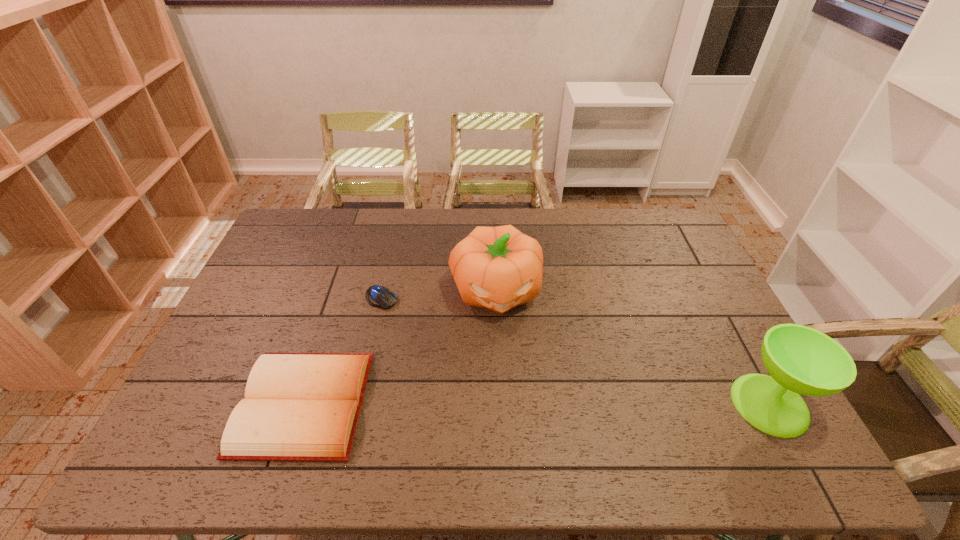
At what (x,y) coordinates should I click in order to perform the action: click on Bible. Please return your answer as a coordinate pair (x, y). Image resolution: width=960 pixels, height=540 pixels. Looking at the image, I should click on (298, 406).

At what (x,y) coordinates should I click in order to perform the action: click on wineglass. Please return your answer as a coordinate pair (x, y). Looking at the image, I should click on (801, 360).

This screenshot has height=540, width=960. In order to click on the shortest object in this screenshot , I will do pyautogui.click(x=377, y=296).

At what (x,y) coordinates should I click in order to perform the action: click on the third object from left to right. Please return your answer as a coordinate pair (x, y). This screenshot has height=540, width=960. Looking at the image, I should click on (498, 268).

The image size is (960, 540). I want to click on free spot located 0.330m on the right of the Bible, so click(492, 403).

Image resolution: width=960 pixels, height=540 pixels. Find the location of `vacant space located 0.240m on the left of the rightmost object`. vacant space located 0.240m on the left of the rightmost object is located at coordinates [x=639, y=404].

Where is `vacant region located on the button side of the computer mouse`? This screenshot has height=540, width=960. vacant region located on the button side of the computer mouse is located at coordinates (454, 355).

This screenshot has height=540, width=960. I want to click on vacant space located 0.090m on the button side of the computer mouse, so click(411, 322).

Locate an element on the screen. Image resolution: width=960 pixels, height=540 pixels. vacant area located 0.110m on the button side of the computer mouse is located at coordinates (416, 325).

The width and height of the screenshot is (960, 540). I want to click on vacant region located 0.190m on the carved face of the pumpkin, so click(510, 379).